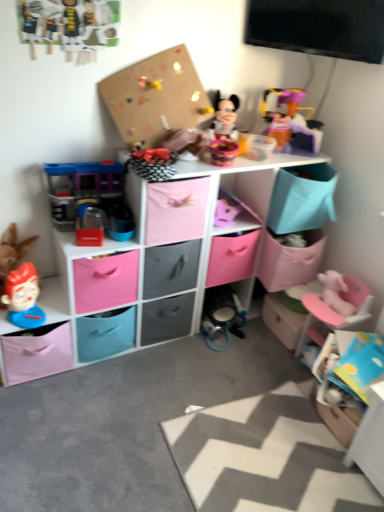
The image size is (384, 512). What are the coordinates of `vacant space in front of wooden toy at lower right, the second storage box viewed from the left` in the screenshot? It's located at tap(270, 359).